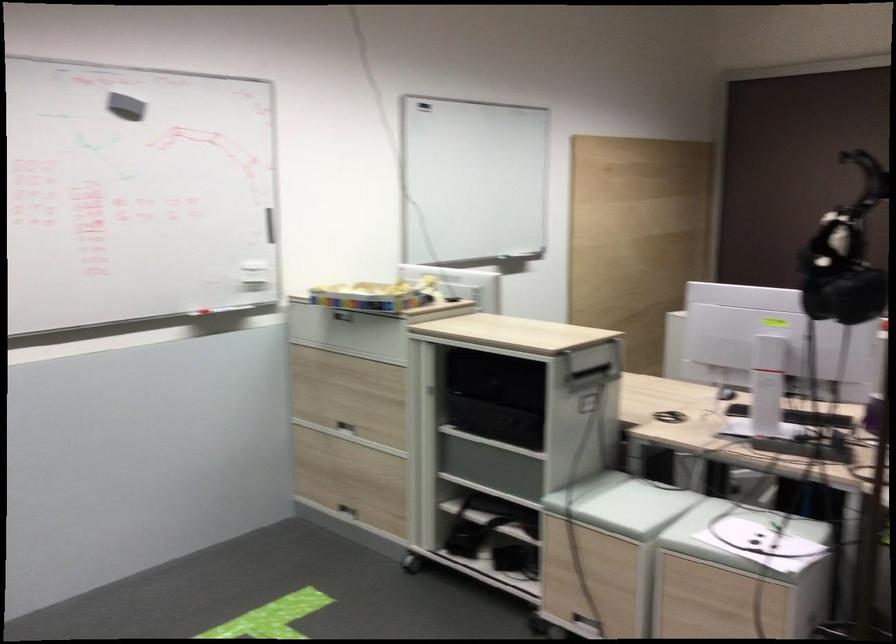
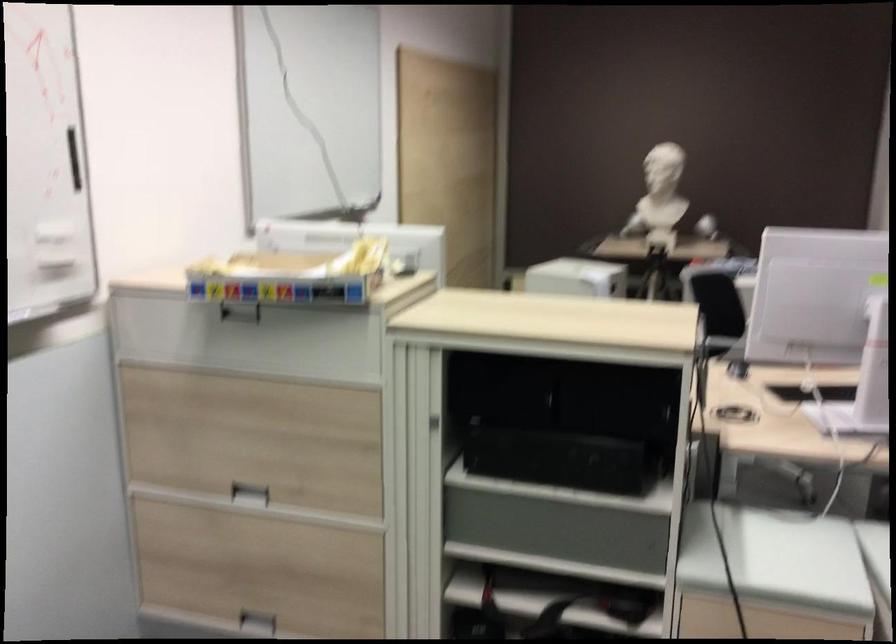
The point at (346, 515) is marked in the first image. Where is the corresponding point in the second image?

(257, 623)